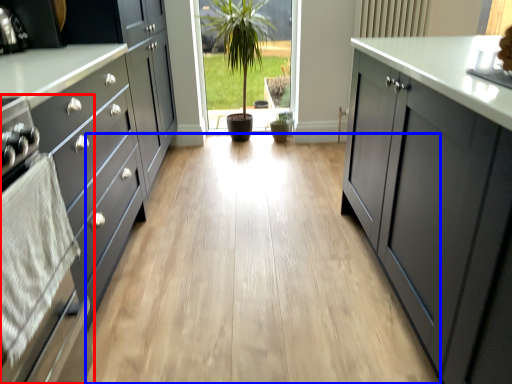
Question: Which of the following is the closest to the observer, oven (highlighted by a red box) or plain (highlighted by a blue box)?

Choices:
 (A) oven
 (B) plain

Answer: (A)